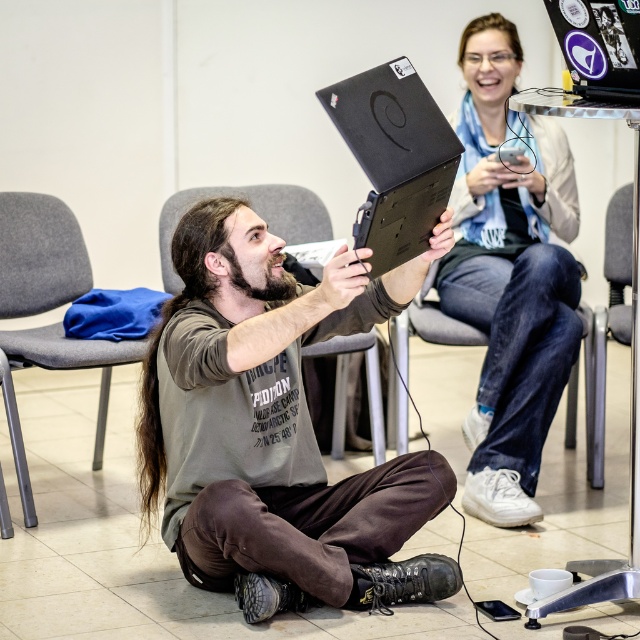
You are trying to hand a document to the person sitting on the gray fabric chair at lower left. You are standing near the matte black tablet at center. Which direction should you move to reach the chair?

Since the matte black tablet at center is closer to you than the gray fabric chair at lower left, you should move backward to reach the chair.

You are standing at the origin point in the image. You see the gray fabric chair at lower left represented by point (38, 253). Is the gray fabric chair at lower left located to your left or right side?

The gray fabric chair at lower left is located to your left side because in coordinate systems, lower left typically corresponds to the left side from the observer perspective.